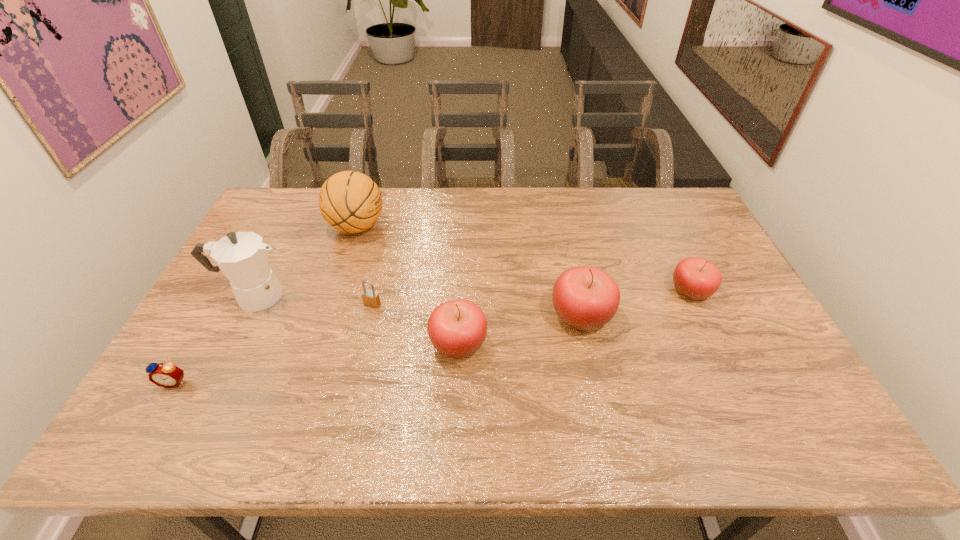
This screenshot has height=540, width=960. Identify the location of the second shortest apple. (457, 328).

You are a GUI agent. You are given a task and a screenshot of the screen. Output one action in this format:
    pyautogui.click(x=<x>, y=<y>)
    Task: Click on the fourth shortest object
    The image size is (960, 540).
    Given the screenshot: What is the action you would take?
    pos(457,328)

The width and height of the screenshot is (960, 540). In order to click on the second object from right to left in this screenshot , I will do `click(586, 298)`.

Where is `the rightmost apple`? The height and width of the screenshot is (540, 960). the rightmost apple is located at coordinates (695, 278).

At what (x,y) coordinates should I click in order to perform the action: click on the shortest apple. Please return your answer as a coordinate pair (x, y). The height and width of the screenshot is (540, 960). Looking at the image, I should click on (695, 278).

Locate an element on the screen. The image size is (960, 540). the farthest object is located at coordinates (349, 201).

Locate an element on the screen. coffeepot is located at coordinates click(x=242, y=256).

Locate an element on the screen. the nearest object is located at coordinates (168, 375).

You are a GUI agent. You are given a task and a screenshot of the screen. Output one action in this format:
    pyautogui.click(x=<x>, y=<y>)
    Task: Click on the padlock
    This screenshot has width=960, height=540.
    Given the screenshot: What is the action you would take?
    pyautogui.click(x=371, y=298)

The width and height of the screenshot is (960, 540). Find the location of `blank area located 0.310m on the right of the leftmost apple`. blank area located 0.310m on the right of the leftmost apple is located at coordinates (606, 344).